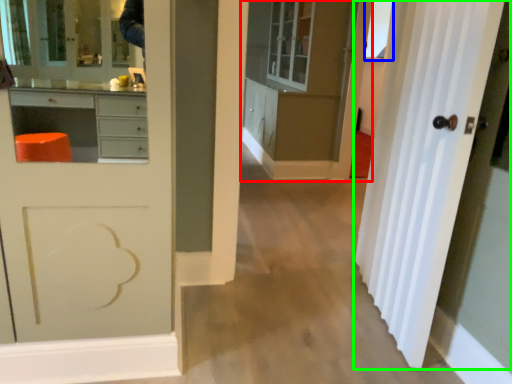
Question: Estimate the real-world distances between objects in this image. Which object is closer to cabinetry (highlighted by a red box), window (highlighted by a blue box) or door (highlighted by a green box)?

Choices:
 (A) window
 (B) door

Answer: (A)